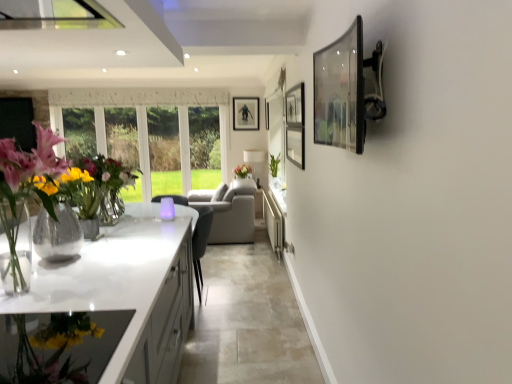
Question: Does matte black picture frame at upper center, which ranks as the first picture frame in left-to-right order, lie behind clear glass picture frame at upper right, which ranks as the 1th picture frame in right-to-left order?

Choices:
 (A) yes
 (B) no

Answer: (A)

Question: Are matte black picture frame at upper center, arranged as the third picture frame when viewed from the right, and clear glass picture frame at upper right, which ranks as the 1th picture frame in right-to-left order, located far from each other?

Choices:
 (A) no
 (B) yes

Answer: (B)

Question: From the image's perspective, is matte black picture frame at upper center, arranged as the third picture frame when viewed from the right, located beneath clear glass picture frame at upper right, positioned as the first picture frame in bottom-to-top order?

Choices:
 (A) yes
 (B) no

Answer: (B)

Question: Can you confirm if matte black picture frame at upper center, the third picture frame in the bottom-to-top sequence, is positioned to the left of clear glass picture frame at upper right, placed as the third picture frame when sorted from back to front?

Choices:
 (A) no
 (B) yes

Answer: (B)

Question: Is matte black picture frame at upper center, acting as the 1th picture frame starting from the back, closer to camera compared to clear glass picture frame at upper right, which ranks as the 1th picture frame in right-to-left order?

Choices:
 (A) no
 (B) yes

Answer: (A)

Question: In terms of width, does white glossy cabinetry at center look wider or thinner when compared to matte black picture frame at upper center, the third picture frame when ordered from front to back?

Choices:
 (A) thin
 (B) wide

Answer: (B)

Question: From the image's perspective, relative to matte black picture frame at upper center, positioned as the 1th picture frame in top-to-bottom order, is white glossy cabinetry at center above or below?

Choices:
 (A) above
 (B) below

Answer: (B)

Question: From a real-world perspective, is white glossy cabinetry at center above or below matte black picture frame at upper center, the third picture frame when ordered from front to back?

Choices:
 (A) above
 (B) below

Answer: (B)

Question: Visually, is white glossy cabinetry at center positioned to the left or to the right of matte black picture frame at upper center, which ranks as the first picture frame in left-to-right order?

Choices:
 (A) left
 (B) right

Answer: (B)

Question: Relative to matte black picture frame at upper center, the second picture frame viewed from the left, is pink matte flower at center in front or behind?

Choices:
 (A) behind
 (B) front

Answer: (A)

Question: In terms of width, does pink matte flower at center look wider or thinner when compared to matte black picture frame at upper center, arranged as the second picture frame when viewed from the back?

Choices:
 (A) wide
 (B) thin

Answer: (A)

Question: Considering the relative positions of pink matte flower at center and matte black picture frame at upper center, arranged as the second picture frame when viewed from the back, in the image provided, is pink matte flower at center to the left or to the right of matte black picture frame at upper center, arranged as the second picture frame when viewed from the back,?

Choices:
 (A) right
 (B) left

Answer: (B)

Question: Is pink matte flower at center spatially inside matte black picture frame at upper center, arranged as the 2th picture frame when viewed from the right, or outside of it?

Choices:
 (A) inside
 (B) outside

Answer: (B)

Question: Looking at the image, does white glossy countertop at lower left seem bigger or smaller compared to clear glass picture frame at upper right, placed as the third picture frame when sorted from back to front?

Choices:
 (A) big
 (B) small

Answer: (A)

Question: From a real-world perspective, is white glossy countertop at lower left positioned above or below clear glass picture frame at upper right, which ranks as the 1th picture frame in right-to-left order?

Choices:
 (A) below
 (B) above

Answer: (A)